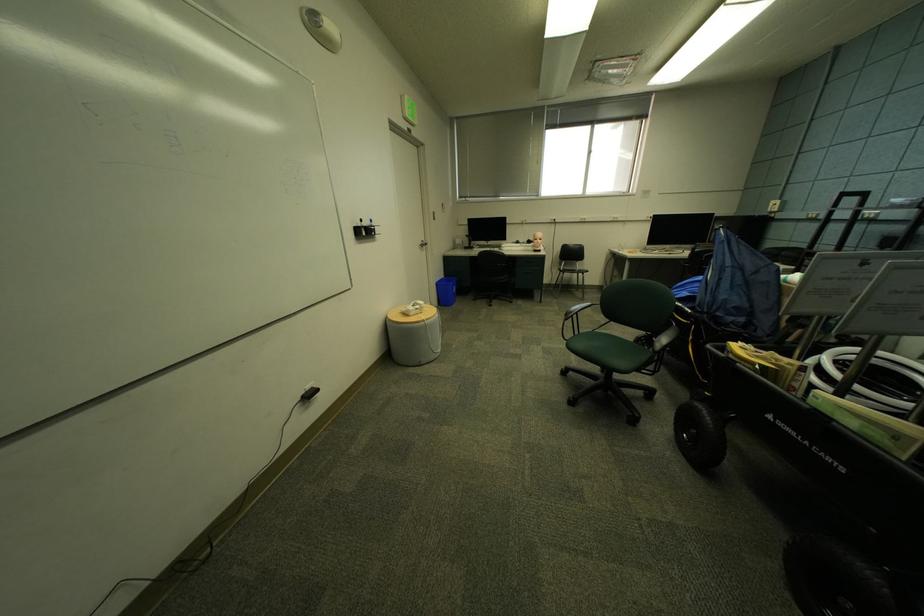
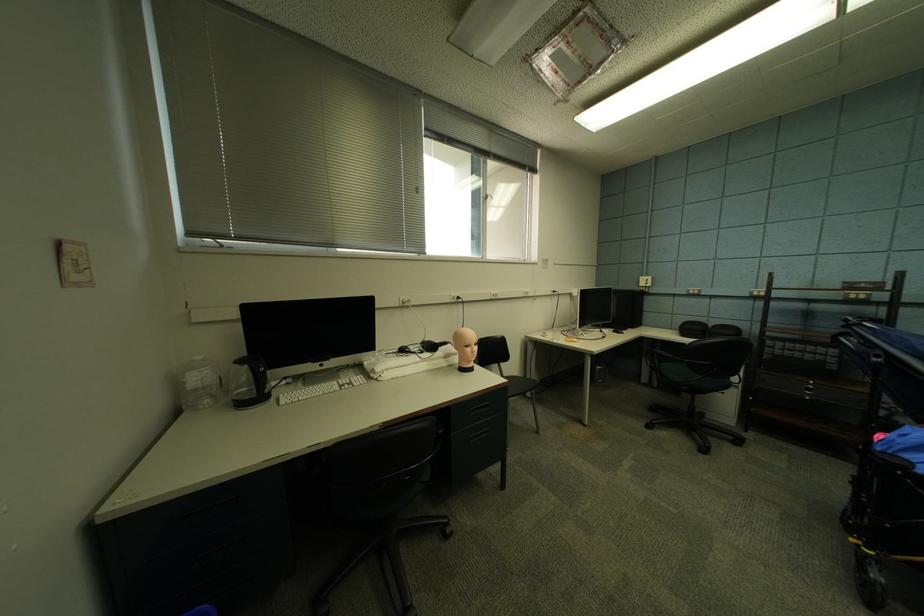
The point at (x=544, y=241) is marked in the first image. Where is the corresponding point in the second image?

(477, 347)